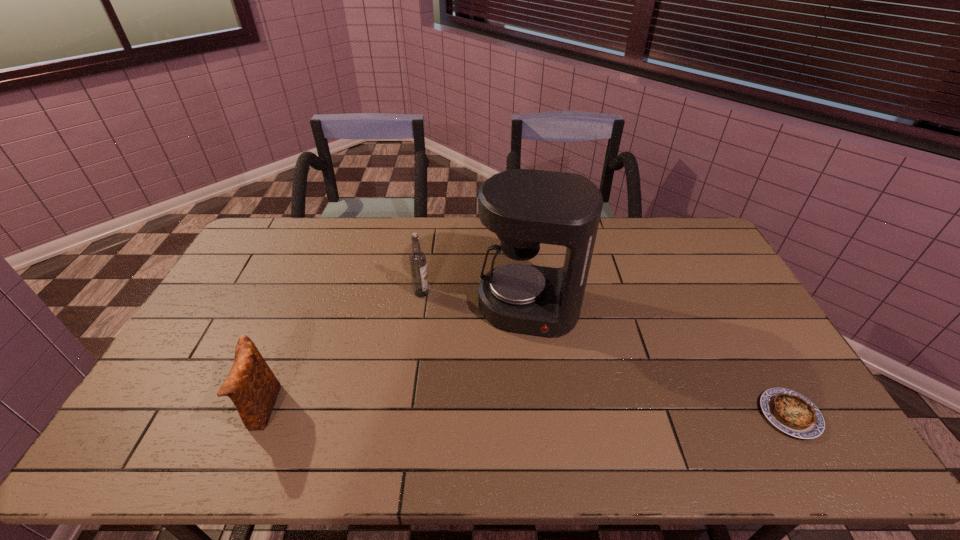
Locate an element on the screen. Image resolution: width=960 pixels, height=540 pixels. the leftmost object is located at coordinates (251, 385).

Locate an element on the screen. This screenshot has width=960, height=540. clutch bag is located at coordinates (251, 385).

This screenshot has height=540, width=960. I want to click on the shortest object, so click(x=792, y=413).

You are a GUI agent. You are given a task and a screenshot of the screen. Output one action in this format:
    pyautogui.click(x=<x>, y=<y>)
    Task: Click on the rightmost object
    
    Given the screenshot: What is the action you would take?
    pyautogui.click(x=792, y=413)

Identify the location of the third object from right to left. (417, 258).

This screenshot has height=540, width=960. Find the location of `vodka`. vodka is located at coordinates (417, 258).

Locate an element on the screen. This screenshot has width=960, height=540. the second object from right to left is located at coordinates (524, 207).

I want to click on coffee maker, so click(524, 207).

The image size is (960, 540). Identify the location of vacant region located 0.110m on the open side of the leftmost object. (203, 409).

I want to click on free space located 0.150m on the open side of the leftmost object, so click(x=187, y=409).